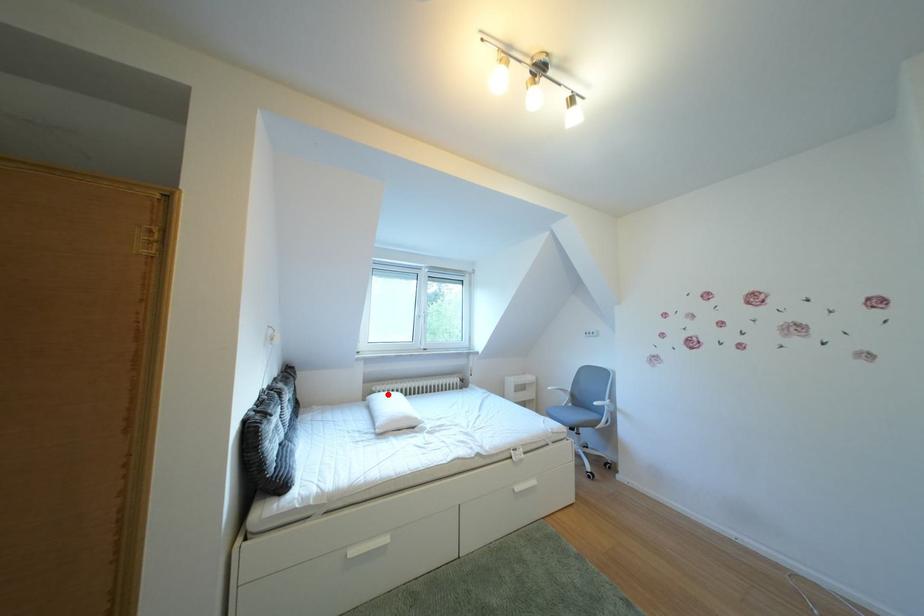
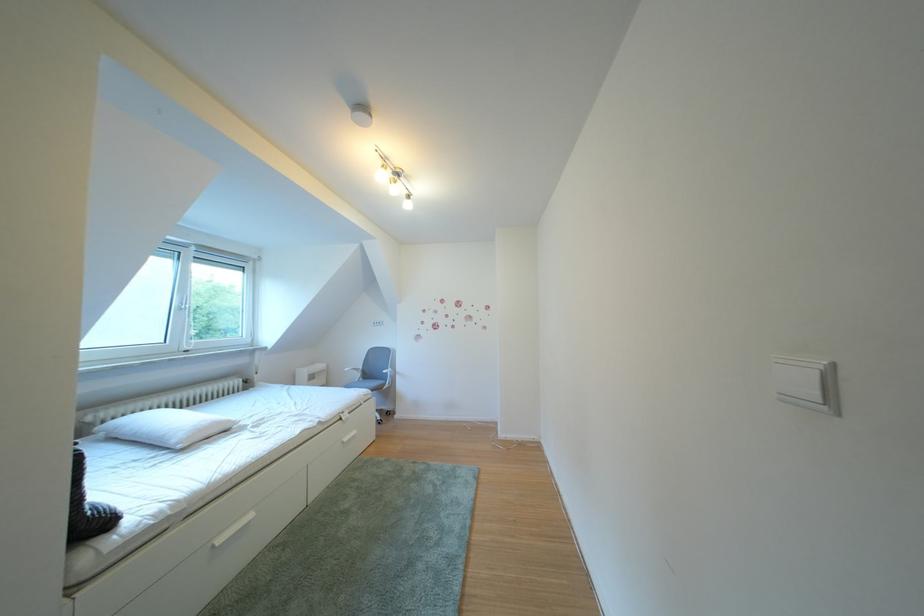
Question: I am providing you with two images of the same scene from different viewpoints. In image1, a red point is highlighted. Considering the same 3D point in image2, which of the following is correct?

Choices:
 (A) It is closer
 (B) It is farther

Answer: (B)